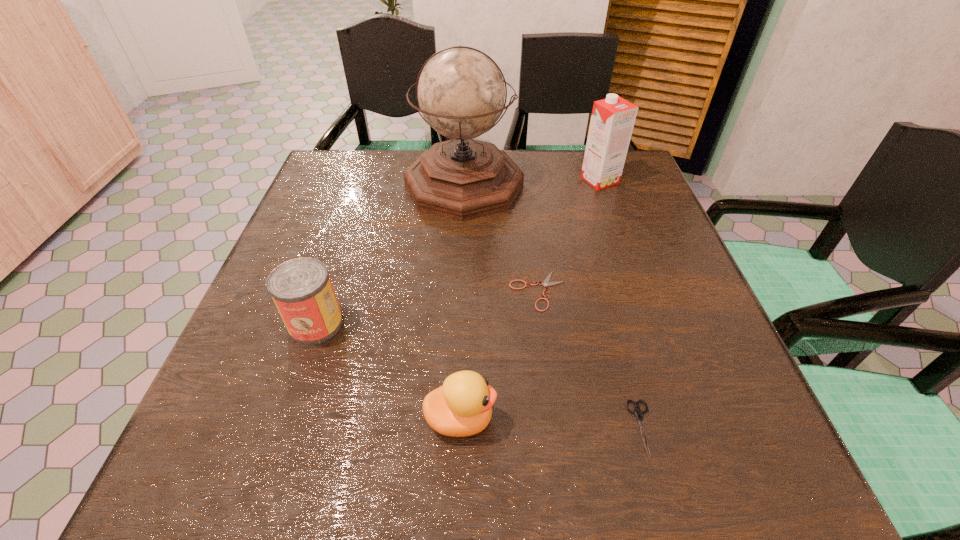
This screenshot has width=960, height=540. Find the location of `free point between the tallest object and the farther shears`. free point between the tallest object and the farther shears is located at coordinates (501, 238).

Locate an element on the screen. Image resolution: width=960 pixels, height=540 pixels. vacant area that lies between the globe and the shorter shears is located at coordinates (501, 238).

I want to click on blank region between the carton and the left shears, so click(x=569, y=235).

Locate an element on the screen. The width and height of the screenshot is (960, 540). free area in between the duckling and the leftmost object is located at coordinates (388, 372).

The width and height of the screenshot is (960, 540). I want to click on the closest object to the second object from right to left, so click(x=546, y=282).

I want to click on the closest object to the third shortest object, so click(546, 282).

You are a GUI agent. You are given a task and a screenshot of the screen. Output one action in this format:
    pyautogui.click(x=<x>, y=<y>)
    Task: Click on the blank area in the image that satisfies the following two spatial constraints: 1. on the face of the fourth tallest object; 2. on the right side of the fifth tallest object
    The width and height of the screenshot is (960, 540).
    Given the screenshot: What is the action you would take?
    pyautogui.click(x=460, y=428)

What are the coordinates of `free space in the image that satisfies the following two spatial constraints: 1. on the back side of the leftmost object; 2. on the left side of the carton` in the screenshot? It's located at (364, 180).

Where is `free space that satisfies the following two spatial constraints: 1. on the face of the duckling; 2. on the back side of the second shortest object`? Image resolution: width=960 pixels, height=540 pixels. free space that satisfies the following two spatial constraints: 1. on the face of the duckling; 2. on the back side of the second shortest object is located at coordinates (460, 428).